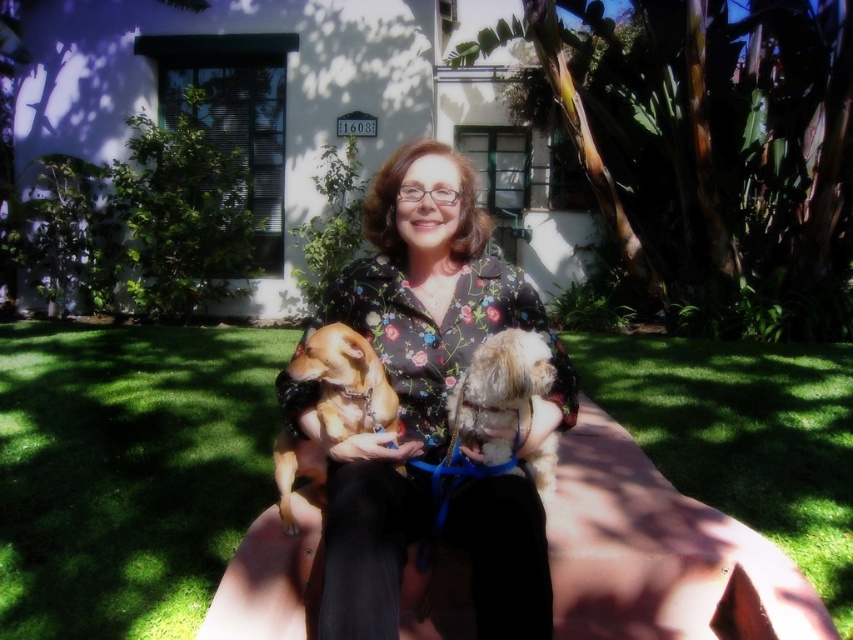
Is floral-patterned blouse at center above golden brown fur at center?

Yes.

Which is more to the left, floral-patterned blouse at center or golden brown fur at center?

Positioned to the left is golden brown fur at center.

Where is `floral-patterned blouse at center`? floral-patterned blouse at center is located at coordinates (407, 369).

Looking at this image, is golden brown fur at center above fluffy beige dog at center?

Incorrect, golden brown fur at center is not positioned above fluffy beige dog at center.

Who is positioned more to the left, golden brown fur at center or fluffy beige dog at center?

From the viewer's perspective, golden brown fur at center appears more on the left side.

Who is more distant from viewer, (277,449) or (477,356)?

Positioned behind is point (277,449).

Image resolution: width=853 pixels, height=640 pixels. What are the coordinates of `golden brown fur at center` in the screenshot? It's located at (346, 381).

Who is more distant from viewer, (358, 490) or (476, 396)?

The point (476, 396) is behind.

Between point (422, 292) and point (515, 378), which one is positioned in front?

Point (515, 378) is in front.

This screenshot has height=640, width=853. What are the coordinates of `floral-patterned blouse at center` in the screenshot? It's located at (407, 369).